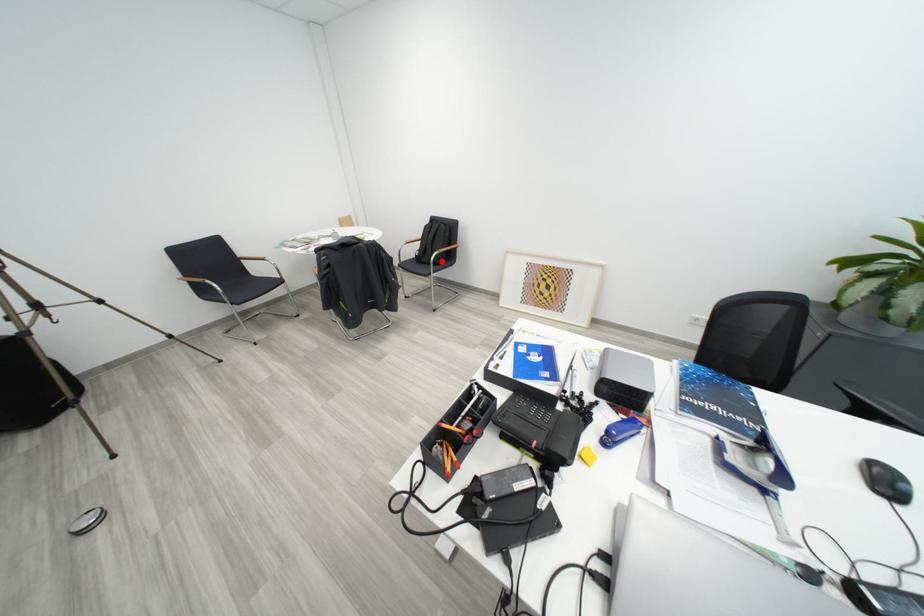
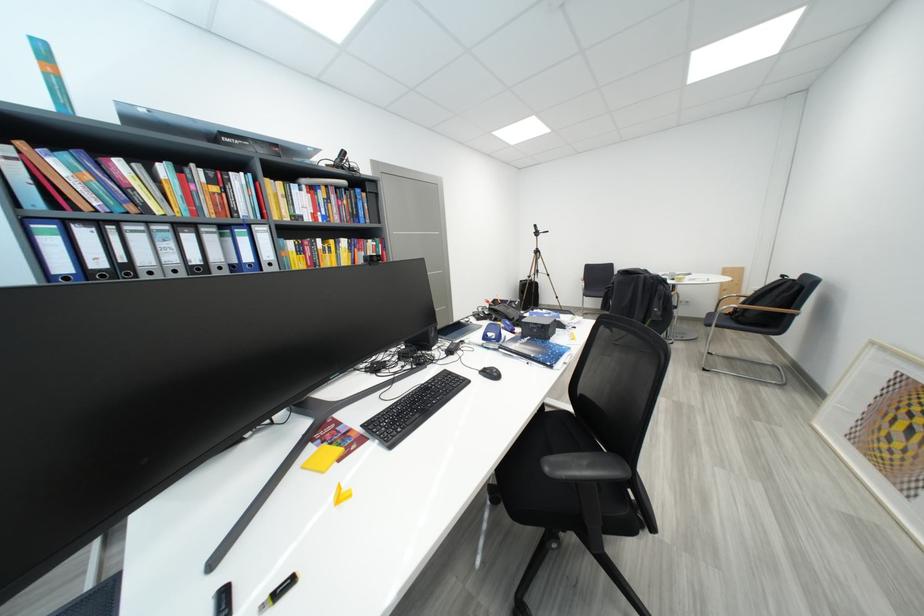
Question: I am providing you with two images of the same scene from different viewpoints. A red point is marked on the first image. At the location where the point appears in image 1, is it still visible in image 2?

Choices:
 (A) Yes
 (B) No

Answer: (B)